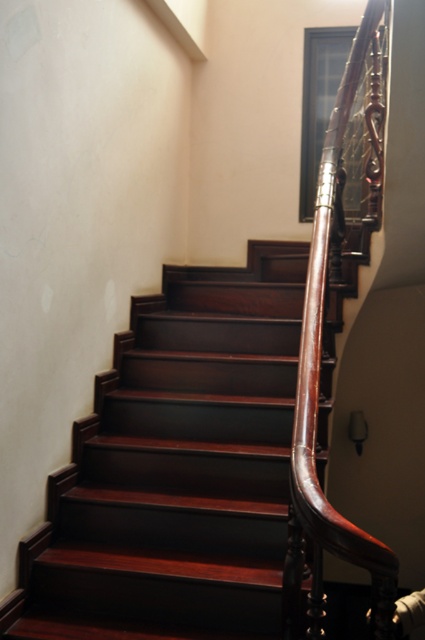
You are standing at the bottom of the staircase and looking up. There are two points marked on the wall near the staircase. The first point is at coordinates point (82, 577) and the second point is at point (289, 579). Which point is closer to you?

Point (82, 577) is closer to you because it is further to the camera than point (289, 579).